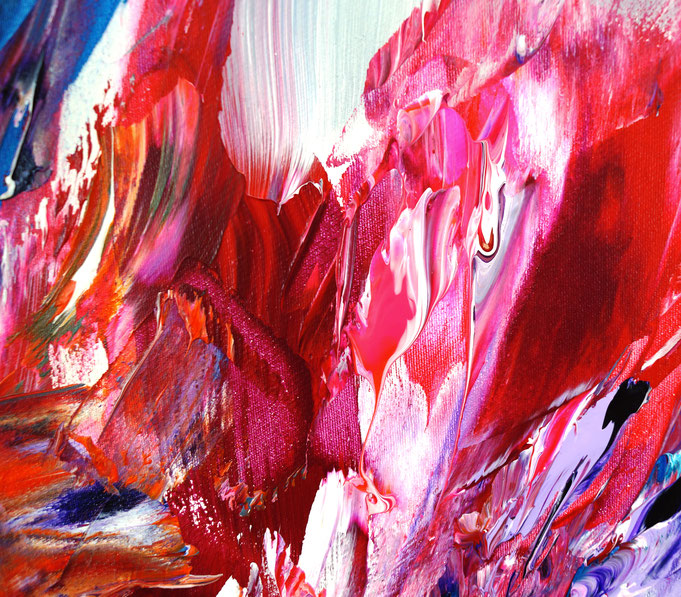
Where is `pink paint`? The height and width of the screenshot is (597, 681). pink paint is located at coordinates [449, 137], [501, 300].